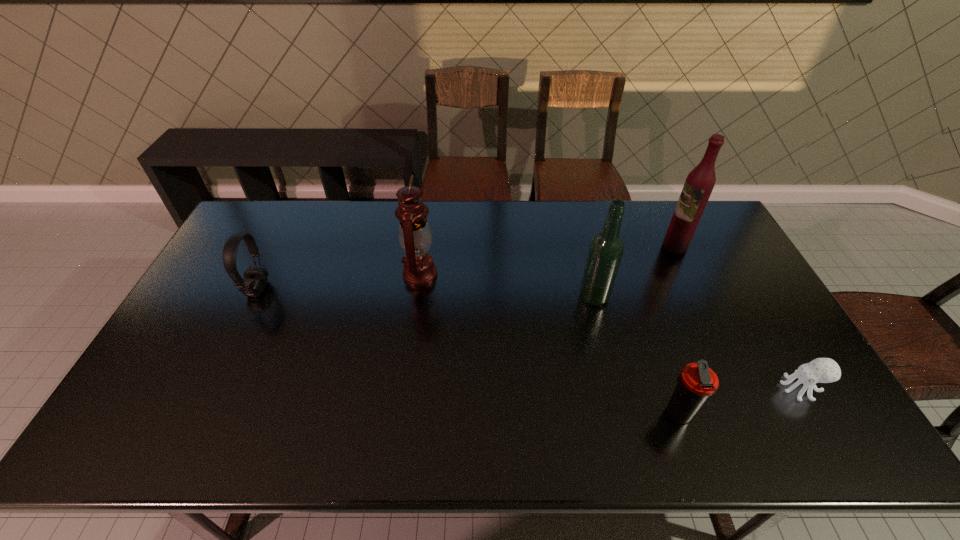
Identify the location of object present at the near edge. (696, 382).

I want to click on object positioned at the left edge, so pyautogui.click(x=255, y=279).

Locate an element on the screen. The image size is (960, 540). liquor present at the right edge is located at coordinates (700, 182).

At what (x,y) coordinates should I click in order to perform the action: click on octopus at the right edge. Please return your answer as a coordinate pair (x, y). This screenshot has width=960, height=540. Looking at the image, I should click on (820, 370).

Identify the location of object positioned at the far right corner. The width and height of the screenshot is (960, 540). (700, 182).

Where is `free space at the far edge of the desktop`? This screenshot has width=960, height=540. free space at the far edge of the desktop is located at coordinates (300, 201).

The height and width of the screenshot is (540, 960). In the image, there is a desktop. Identify the location of vacant space at the near edge. (194, 442).

Where is `free space at the right edge`? The image size is (960, 540). free space at the right edge is located at coordinates (768, 401).

Identify the location of vacant space at the far left corner of the desktop. Image resolution: width=960 pixels, height=540 pixels. (277, 212).

This screenshot has height=540, width=960. Identify the location of free spot at the near right corner of the desktop. (804, 422).